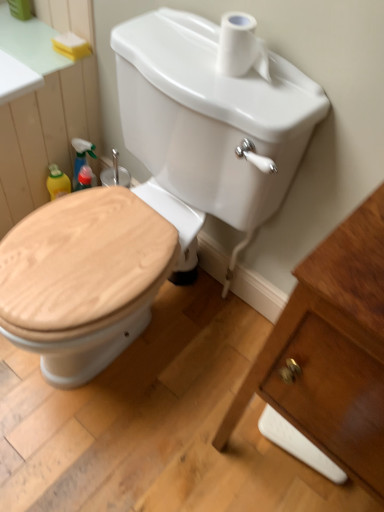
Locate an element on the screen. This screenshot has width=384, height=512. free space below wooden toilet seat at center (from a real-world perspective) is located at coordinates (157, 331).